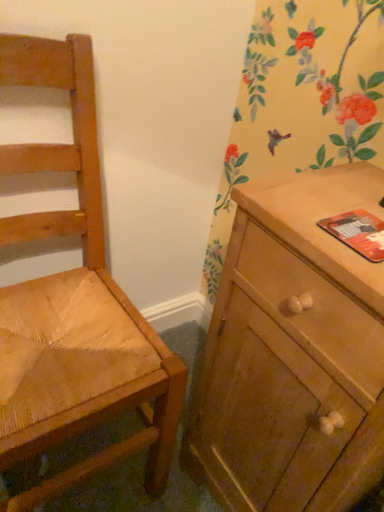
Locate an element on the screen. Image resolution: width=384 pixels, height=512 pixels. vacant space situated on the left part of orange matte paperback book at right is located at coordinates (293, 220).